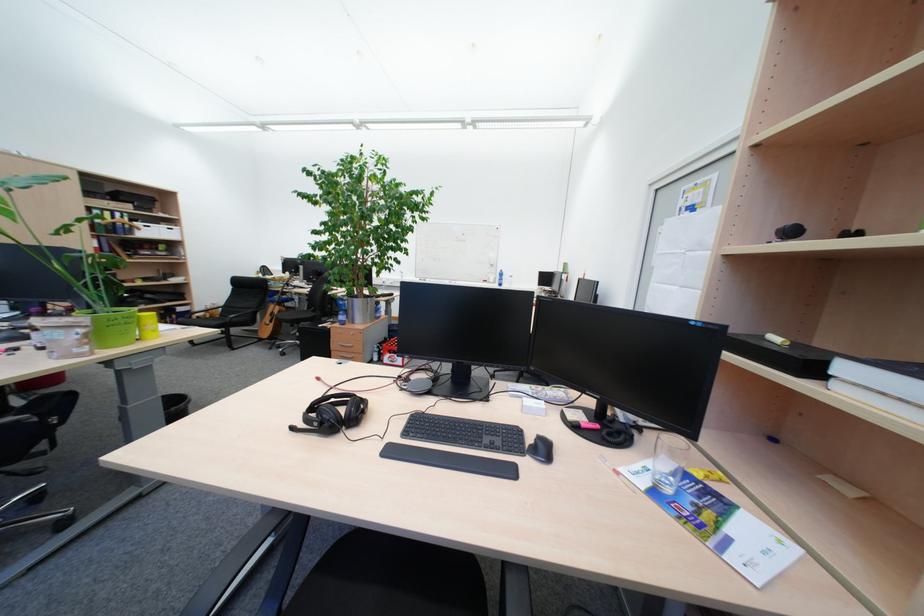
You are a GUI agent. You are given a task and a screenshot of the screen. Output one action in this format:
    pyautogui.click(x=<x>, y=<y>)
    Task: Click on the large water bottle
    This screenshot has width=924, height=616.
    Given the screenshot: What is the action you would take?
    pyautogui.click(x=669, y=461)